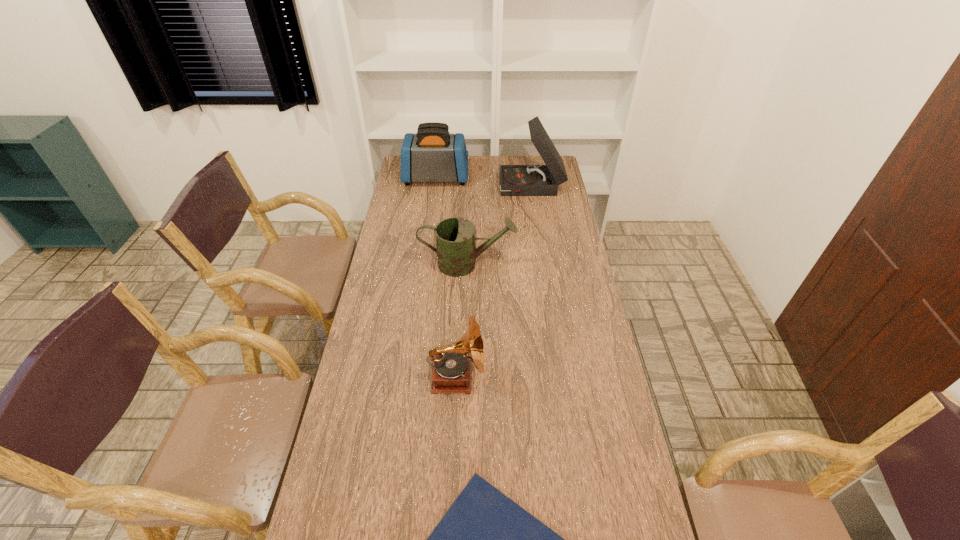
In the image, there is a desktop. Identify the location of free space at the left edge. The image size is (960, 540). (426, 190).

In the image, there is a desktop. At what (x,y) coordinates should I click in order to perform the action: click on free region at the right edge. Please return your answer as a coordinate pair (x, y). Looking at the image, I should click on (575, 393).

Locate an element on the screen. Image resolution: width=960 pixels, height=540 pixels. vacant area that lies between the farther phonograph_record and the toaster is located at coordinates (484, 183).

Locate an element on the screen. free space that is in between the toaster and the right phonograph_record is located at coordinates (484, 183).

What are the coordinates of `vacant space that's between the fourth farthest object and the watering can` in the screenshot? It's located at (462, 320).

This screenshot has height=540, width=960. Identify the location of vacant space in between the nearer phonograph_record and the right phonograph_record. (494, 282).

I want to click on vacant region between the shorter phonograph_record and the toaster, so click(446, 278).

Where is `free space between the left phonograph_record and the right phonograph_record`? This screenshot has height=540, width=960. free space between the left phonograph_record and the right phonograph_record is located at coordinates (494, 282).

The height and width of the screenshot is (540, 960). In order to click on object that is the second nearest to the taller phonograph_record in this screenshot , I will do `click(456, 250)`.

Identify which object is the third nearest to the right phonograph_record. Please provide its 2D coordinates. Your answer should be formatted as a tuple, i.e. [(x, y)], where the tuple contains the x and y coordinates of a point satisfying the conditions above.

[(452, 369)]